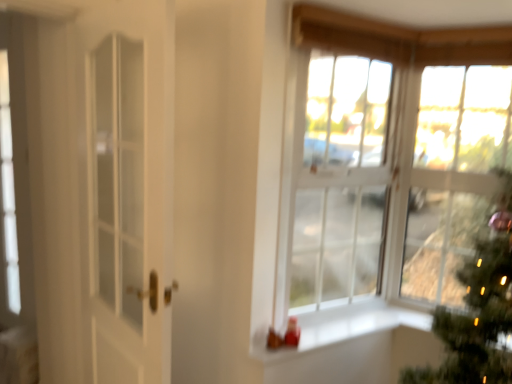
Question: Does white glass window at center, which appears as the 2th window when viewed from the back, have a larger size compared to clear glass window at upper right, which appears as the first window when viewed from the front?

Choices:
 (A) no
 (B) yes

Answer: (A)

Question: Considering the relative positions of white glass window at center, the 2th window when ordered from front to back, and clear glass window at upper right, which appears as the first window when viewed from the front, in the image provided, is white glass window at center, the 2th window when ordered from front to back, to the right of clear glass window at upper right, which appears as the first window when viewed from the front, from the viewer's perspective?

Choices:
 (A) no
 (B) yes

Answer: (A)

Question: Is clear glass window at upper right, which is the 3th window from back to front, surrounded by white glass window at center, which appears as the 2th window when viewed from the back?

Choices:
 (A) yes
 (B) no

Answer: (B)

Question: Can you confirm if white glass window at center, which appears as the 2th window when viewed from the back, is shorter than clear glass window at upper right, which appears as the first window when viewed from the front?

Choices:
 (A) no
 (B) yes

Answer: (B)

Question: Is white glass window at center, the 2th window when ordered from front to back, placed right next to clear glass window at upper right, which appears as the first window when viewed from the front?

Choices:
 (A) no
 (B) yes

Answer: (B)

Question: Does white glass window at center, the 2th window when ordered from front to back, have a lesser width compared to clear glass window at upper right, which appears as the first window when viewed from the front?

Choices:
 (A) no
 (B) yes

Answer: (B)

Question: Does clear glass window at upper right, which is the 3th window from back to front, have a greater height compared to white smooth window sill at center?

Choices:
 (A) yes
 (B) no

Answer: (A)

Question: Does clear glass window at upper right, which appears as the first window when viewed from the front, appear on the left side of white smooth window sill at center?

Choices:
 (A) no
 (B) yes

Answer: (A)

Question: Is clear glass window at upper right, which appears as the first window when viewed from the front, in contact with white smooth window sill at center?

Choices:
 (A) no
 (B) yes

Answer: (A)

Question: From the image's perspective, is clear glass window at upper right, which appears as the first window when viewed from the front, beneath white smooth window sill at center?

Choices:
 (A) no
 (B) yes

Answer: (A)

Question: Considering the relative positions of clear glass window at upper right, which is the 3th window from back to front, and white smooth window sill at center in the image provided, is clear glass window at upper right, which is the 3th window from back to front, in front of white smooth window sill at center?

Choices:
 (A) no
 (B) yes

Answer: (B)

Question: Is white smooth window sill at center inside clear glass window at upper right, which appears as the first window when viewed from the front?

Choices:
 (A) yes
 (B) no

Answer: (B)

Question: Can you confirm if white glass window at center, the 2th window when ordered from front to back, is wider than white smooth window sill at center?

Choices:
 (A) yes
 (B) no

Answer: (B)